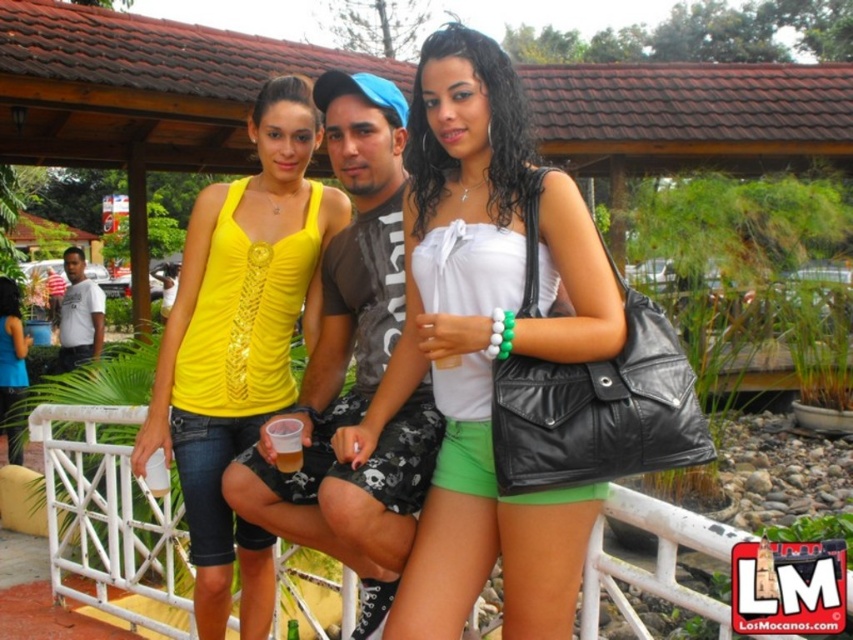
The height and width of the screenshot is (640, 853). I want to click on yellow matte tank top at center, so click(x=241, y=342).

Does yellow matte tank top at center have a smaller size compared to matte black t-shirt at center?

No, yellow matte tank top at center is not smaller than matte black t-shirt at center.

This screenshot has height=640, width=853. I want to click on yellow matte tank top at center, so click(241, 342).

At what (x,y) coordinates should I click in order to perform the action: click on yellow matte tank top at center. Please return your answer as a coordinate pair (x, y). The image size is (853, 640). Looking at the image, I should click on coord(241,342).

Does matte black t-shirt at center have a greater height compared to white cotton shirt at left?

Indeed, matte black t-shirt at center has a greater height compared to white cotton shirt at left.

Is point (345, 512) positioned after point (86, 304)?

No, (345, 512) is in front of (86, 304).

This screenshot has width=853, height=640. Find the location of `matte black t-shirt at center`. matte black t-shirt at center is located at coordinates (355, 369).

Who is higher up, white matte tank top at center or yellow matte tank top at center?

white matte tank top at center is higher up.

Looking at this image, does white matte tank top at center have a lesser height compared to yellow matte tank top at center?

Yes, white matte tank top at center is shorter than yellow matte tank top at center.

Is point (544, 225) closer to camera compared to point (225, 548)?

That is True.

I want to click on white matte tank top at center, so click(485, 344).